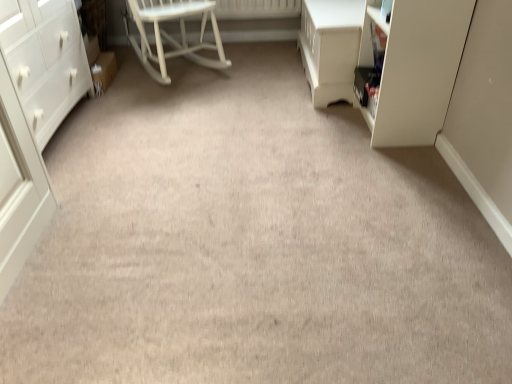
This screenshot has width=512, height=384. Identify the location of vacant space in front of white glossy vanity at upper right. (309, 126).